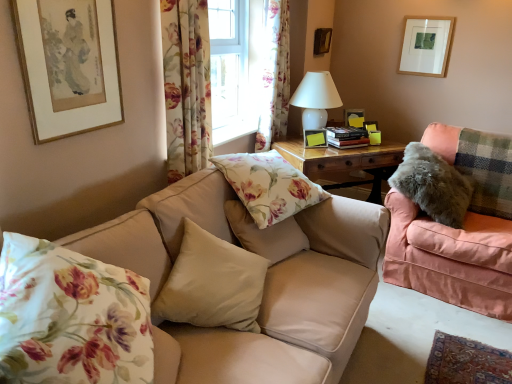
Question: Would you say matte gold picture frame at upper left, the first picture frame when ordered from front to back, is part of matte white picture frame at upper right, which appears as the first picture frame when viewed from the right,'s contents?

Choices:
 (A) yes
 (B) no

Answer: (B)

Question: Does matte white picture frame at upper right, positioned as the 2th picture frame in back-to-front order, have a lesser height compared to matte gold picture frame at upper left, which is the 4th picture frame from right to left?

Choices:
 (A) yes
 (B) no

Answer: (A)

Question: Is matte white picture frame at upper right, placed as the third picture frame when sorted from front to back, oriented away from matte gold picture frame at upper left, the first picture frame when ordered from front to back?

Choices:
 (A) no
 (B) yes

Answer: (A)

Question: Are matte white picture frame at upper right, placed as the fourth picture frame when sorted from left to right, and matte gold picture frame at upper left, which is the 4th picture frame from right to left, far apart?

Choices:
 (A) yes
 (B) no

Answer: (A)

Question: From the image's perspective, is matte white picture frame at upper right, placed as the third picture frame when sorted from front to back, beneath matte gold picture frame at upper left, which is the 4th picture frame from right to left?

Choices:
 (A) no
 (B) yes

Answer: (A)

Question: From a real-world perspective, is matte white picture frame at upper right, positioned as the 2th picture frame in back-to-front order, on matte gold picture frame at upper left, placed as the first picture frame when sorted from left to right?

Choices:
 (A) yes
 (B) no

Answer: (A)

Question: Is fluffy pink couch at right, which is the 1th studio couch in right-to-left order, located within matte gold picture frame at upper left, which is the 4th picture frame in back-to-front order?

Choices:
 (A) no
 (B) yes

Answer: (A)

Question: Is matte gold picture frame at upper left, which is the 4th picture frame in back-to-front order, far from fluffy pink couch at right, marked as the second studio couch in a left-to-right arrangement?

Choices:
 (A) yes
 (B) no

Answer: (A)

Question: Does matte gold picture frame at upper left, placed as the first picture frame when sorted from left to right, have a greater height compared to fluffy pink couch at right, marked as the second studio couch in a left-to-right arrangement?

Choices:
 (A) no
 (B) yes

Answer: (A)

Question: From the image's perspective, is matte gold picture frame at upper left, which is the 4th picture frame in back-to-front order, on top of fluffy pink couch at right, which is the 1th studio couch in right-to-left order?

Choices:
 (A) no
 (B) yes

Answer: (B)

Question: Is matte gold picture frame at upper left, the first picture frame when ordered from front to back, positioned before fluffy pink couch at right, which is the 1th studio couch in right-to-left order?

Choices:
 (A) no
 (B) yes

Answer: (B)

Question: From a real-world perspective, does matte gold picture frame at upper left, the first picture frame when ordered from front to back, sit lower than fluffy pink couch at right, marked as the second studio couch in a left-to-right arrangement?

Choices:
 (A) yes
 (B) no

Answer: (B)

Question: From the image's perspective, is beige fabric pillow at center, positioned as the 2th pillow in left-to-right order, above beige fabric couch at center, arranged as the first studio couch when viewed from the left?

Choices:
 (A) no
 (B) yes

Answer: (B)